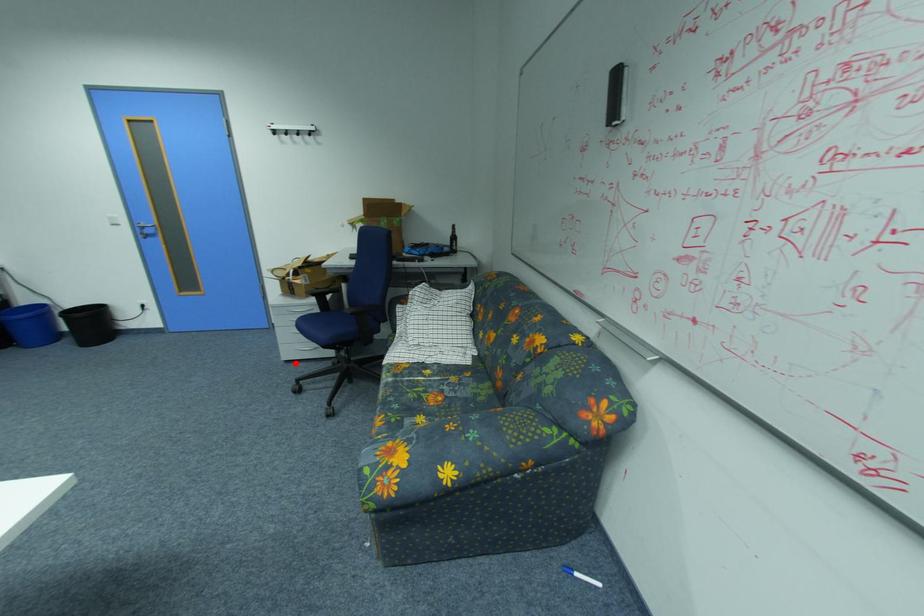
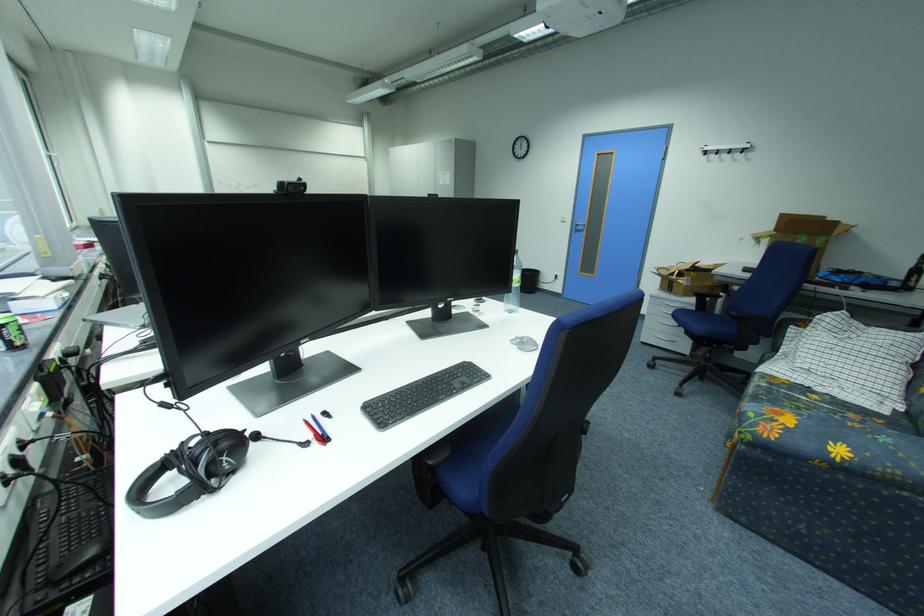
Question: I am providing you with two images of the same scene from different viewpoints. Image1 has a red point marked. In image2, the corresponding 3D location appears at what relative position? Reply with the corresponding letter.

Choices:
 (A) Closer
 (B) Farther

Answer: (B)